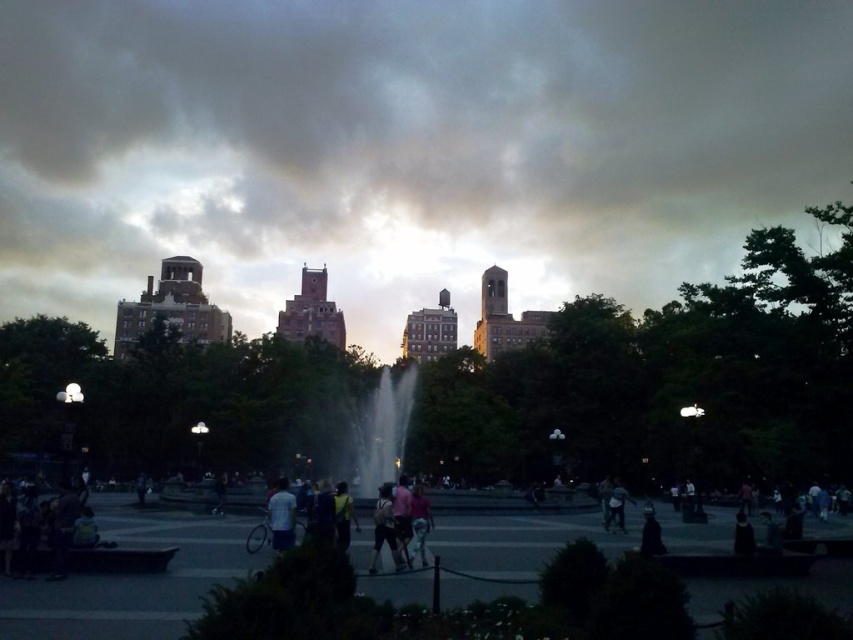
Looking at this image, measure the distance from yellow fabric jacket at center to dark blue jeans at center.

They are 29.41 meters apart.

Between yellow fabric jacket at center and dark blue jeans at center, which one is positioned higher?

Positioned higher is yellow fabric jacket at center.

Measure the distance between yellow fabric jacket at center and camera.

They are 236.56 feet apart.

You are a GUI agent. You are given a task and a screenshot of the screen. Output one action in this format:
    pyautogui.click(x=<x>, y=<y>)
    Task: Click on the yellow fabric jacket at center
    The image size is (853, 640).
    Given the screenshot: What is the action you would take?
    pyautogui.click(x=343, y=516)

Consider the image. Does light blue shirt at center have a larger size compared to matte pink shirt at center?

Correct, light blue shirt at center is larger in size than matte pink shirt at center.

Which is in front, point (277, 516) or point (392, 500)?

Point (277, 516) is in front.

The height and width of the screenshot is (640, 853). I want to click on light blue shirt at center, so click(x=281, y=516).

Is dark matte jacket at lower right shorter than dark fabric jacket at lower right?

Correct, dark matte jacket at lower right is not as tall as dark fabric jacket at lower right.

Which is more to the right, dark matte jacket at lower right or dark fabric jacket at lower right?

dark fabric jacket at lower right

Is point (660, 538) closer to viewer compared to point (737, 552)?

No.

At what (x,y) coordinates should I click in order to perform the action: click on dark matte jacket at lower right. Please return your answer as a coordinate pair (x, y). The image size is (853, 640). Looking at the image, I should click on (650, 532).